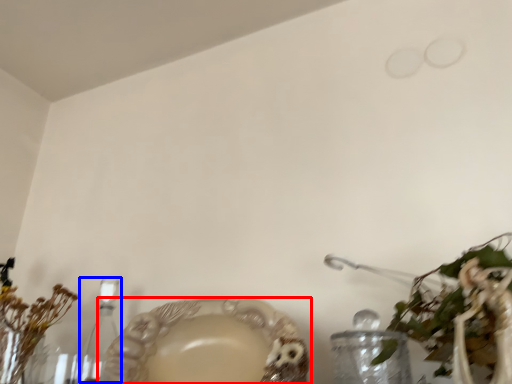
Question: Which of the following is the farthest to the observer, tableware (highlighted by a red box) or candle holder (highlighted by a blue box)?

Choices:
 (A) tableware
 (B) candle holder

Answer: (B)